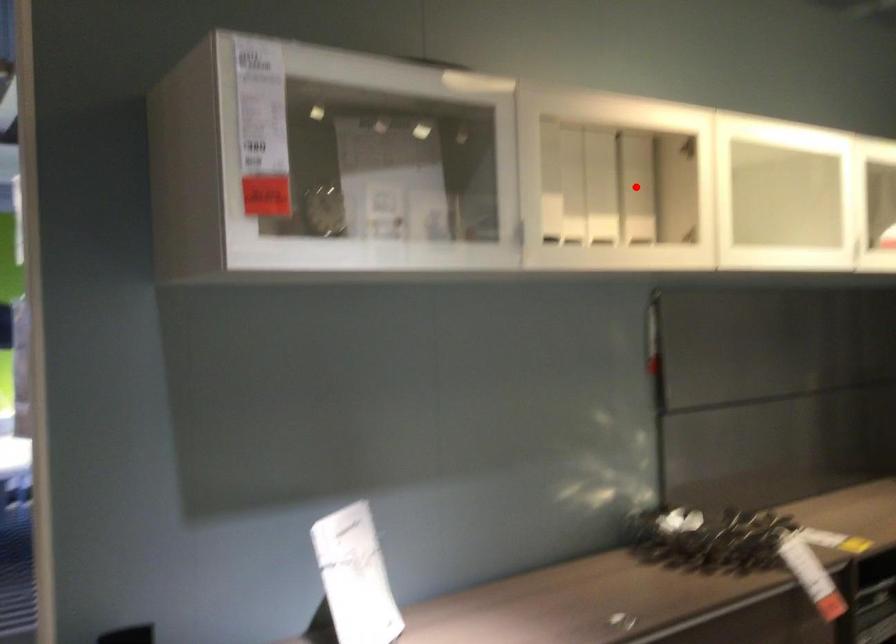
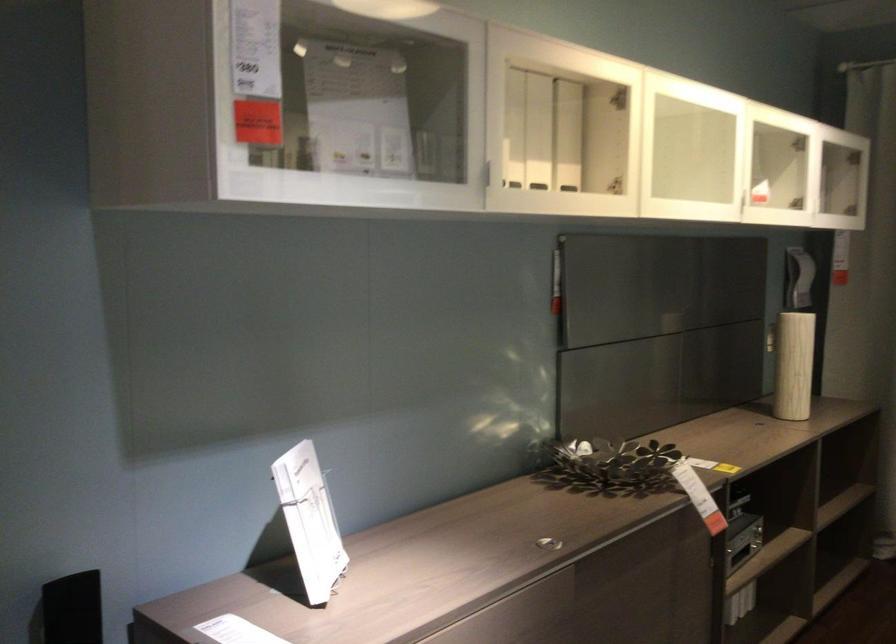
The point at the highlighted location is marked in the first image. Where is the corresponding point in the second image?

(567, 135)